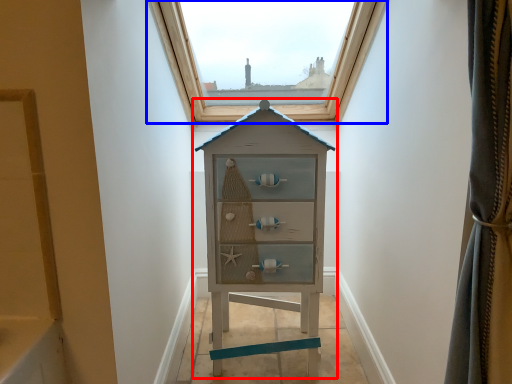
Question: Which of the following is the farthest to the observer, chest of drawers (highlighted by a red box) or window (highlighted by a blue box)?

Choices:
 (A) chest of drawers
 (B) window

Answer: (B)